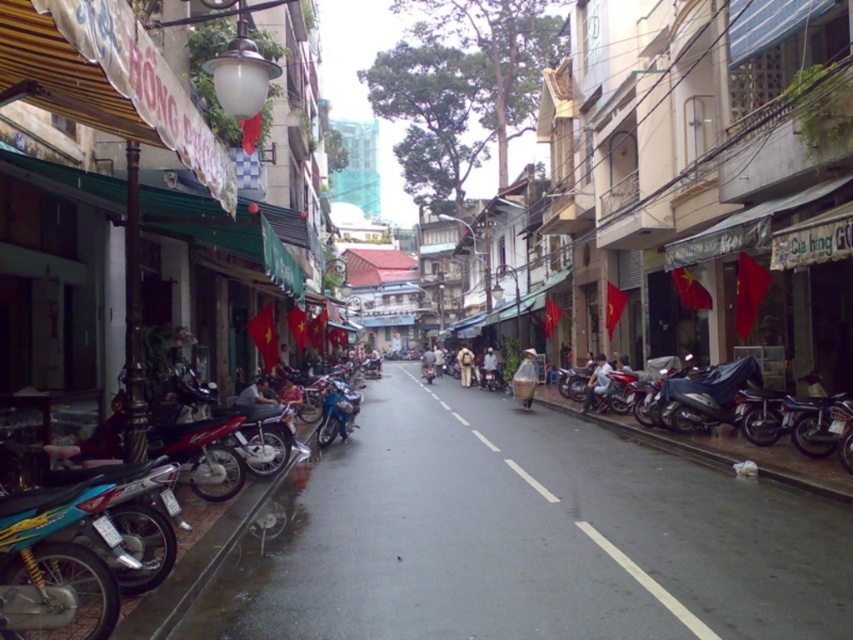
Question: Which of the following is the farthest from the observer?

Choices:
 (A) white plastic bag at center
 (B) metallic silver motorbike at center

Answer: (A)

Question: Which is nearer to the white matte shirt at center-right?

Choices:
 (A) blue metallic motorcycle at center
 (B) metallic silver motorbike at center
 (C) light brown fabric bag at center
 (D) metallic silver scooter at center

Answer: (D)

Question: Does matte plastic bag at center appear on the left side of light brown fabric bag at center?

Choices:
 (A) no
 (B) yes

Answer: (A)

Question: Does metallic silver scooter at center have a lesser width compared to blue metallic motorcycle at center?

Choices:
 (A) no
 (B) yes

Answer: (A)

Question: Estimate the real-world distances between objects in this image. Which object is closer to the metallic silver motorbike at center?

Choices:
 (A) white plastic bag at center
 (B) matte plastic bag at center
 (C) light brown fabric bag at center

Answer: (B)

Question: Observing the image, what is the correct spatial positioning of metallic silver motorbike at center in reference to blue metallic motorcycle at center?

Choices:
 (A) above
 (B) below

Answer: (B)